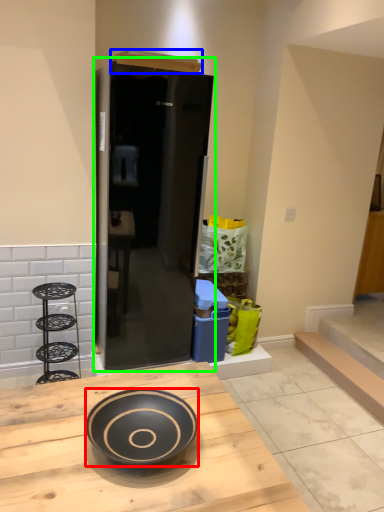
Question: Which object is positioned closest to bowl (highlighted by a red box)? Select from box (highlighted by a blue box) and door (highlighted by a green box).

Choices:
 (A) box
 (B) door

Answer: (B)